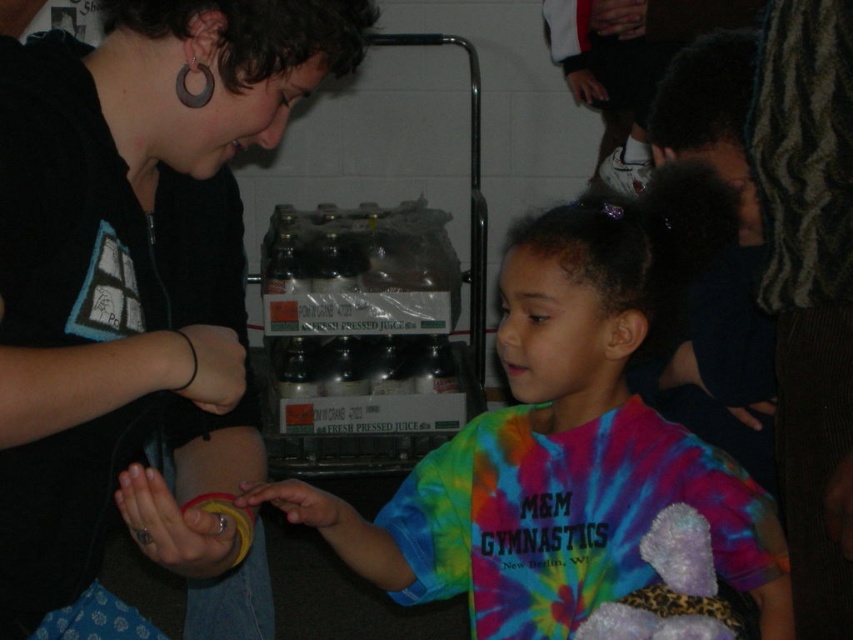
You are a photographer trying to capture the interaction between the two individuals in the scene. The point at coordinates (x=573, y=442) is crucial for focusing on the main subject. Can you identify what this point corresponds to?

The point at coordinates (x=573, y=442) corresponds to the tie dye fabric shirt at center, which is part of the child wearing the M M Gymnastics shirt.

You are a photographer trying to capture a closeup of the smooth yellow ring at center without including the black rubber bracelet at lower left in the frame. Based on their positions, is this possible?

The black rubber bracelet at lower left is located above the smooth yellow ring at center, so it is possible to capture a closeup of the smooth yellow ring at center without including the bracelet by adjusting the camera angle to exclude the area above the ring.